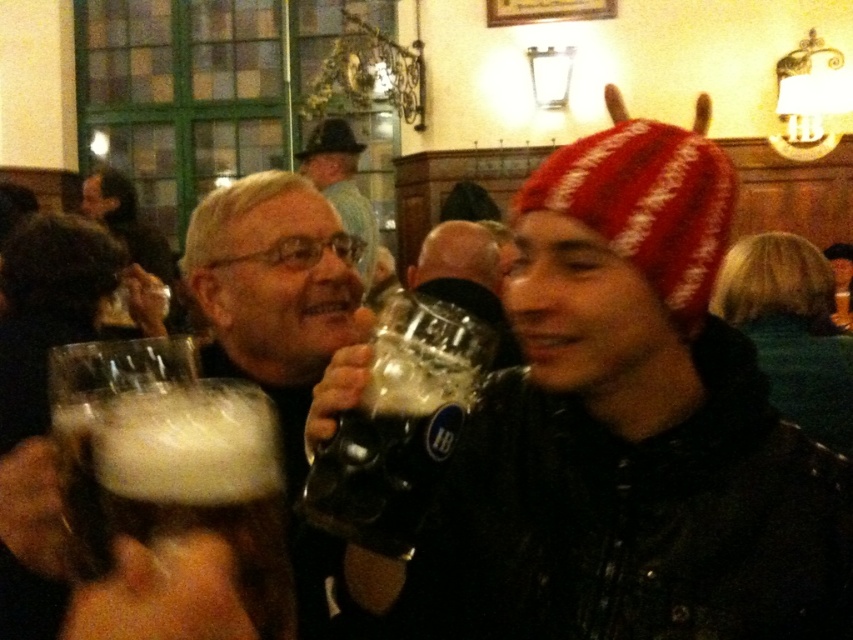
You are a bartender in the beer hall and need to place a new order of coasters. If the matte black beer mug at center is currently resting on a coaster, which coaster size would you recommend for the brushed metal hat at upper center to ensure it fits properly?

The matte black beer mug at center is taller than the brushed metal hat at upper center, so the coaster for the brushed metal hat at upper center should be smaller in diameter than the coaster currently under the matte black beer mug at center.

You are a photographer trying to capture a detailed shot of the foamy brown glass at lower left and the brushed metal hat at upper center. Since you want both objects to be clearly visible in the frame, which object should you focus on first to ensure sharpness?

The foamy brown glass at lower left has a lesser width compared to the brushed metal hat at upper center. Therefore, you should focus on the foamy brown glass at lower left first because smaller objects require more precise focus to appear sharp in photographs.